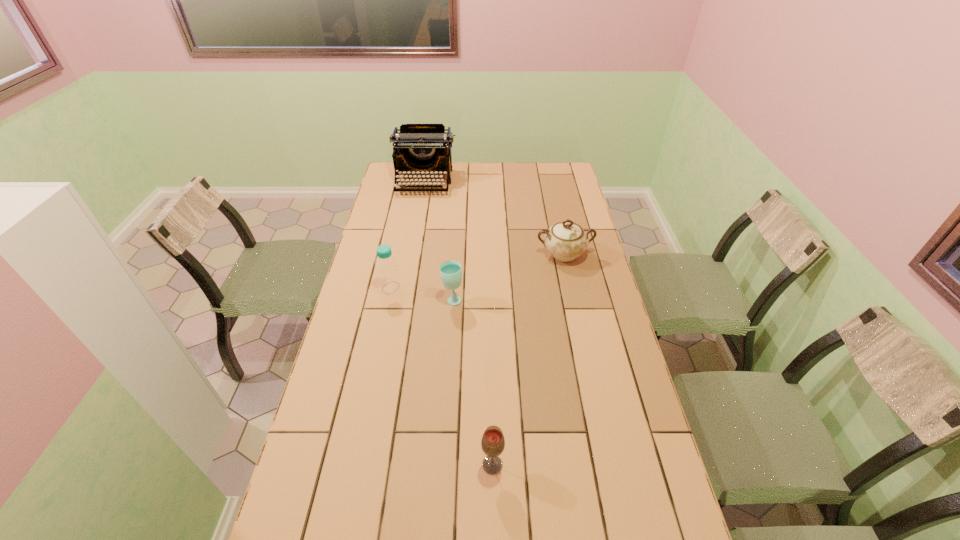
At what (x,y) coordinates should I click in order to perform the action: click on vacant position located on the left of the rightmost object. Please return your answer as a coordinate pair (x, y). Looking at the image, I should click on (460, 254).

At what (x,y) coordinates should I click in order to perform the action: click on vacant region located 0.130m on the right of the right glass. Please return your answer as a coordinate pair (x, y). Image resolution: width=960 pixels, height=540 pixels. Looking at the image, I should click on (554, 465).

You are a GUI agent. You are given a task and a screenshot of the screen. Output one action in this format:
    pyautogui.click(x=<x>, y=<y>)
    Task: Click on the vacant space located 0.280m on the right of the farther glass
    The height and width of the screenshot is (540, 960).
    Given the screenshot: What is the action you would take?
    pyautogui.click(x=541, y=300)

This screenshot has width=960, height=540. What are the coordinates of `object that is at the far edge` in the screenshot? It's located at (417, 148).

Where is `typewriter located at the left edge`? typewriter located at the left edge is located at coordinates (417, 148).

Locate an element on the screen. This screenshot has height=540, width=960. bottle at the left edge is located at coordinates (388, 275).

You are a GUI agent. You are given a task and a screenshot of the screen. Output one action in this format:
    pyautogui.click(x=<x>, y=<y>)
    Task: Click on the object that is at the right edge
    The width and height of the screenshot is (960, 540).
    Given the screenshot: What is the action you would take?
    pyautogui.click(x=566, y=240)

The width and height of the screenshot is (960, 540). Find the location of `object that is at the far left corner`. object that is at the far left corner is located at coordinates (417, 148).

Locate an element on the screen. The height and width of the screenshot is (540, 960). blank space at the far edge of the desktop is located at coordinates (440, 174).

The width and height of the screenshot is (960, 540). In order to click on vacant point at the left edge in this screenshot , I will do `click(394, 312)`.